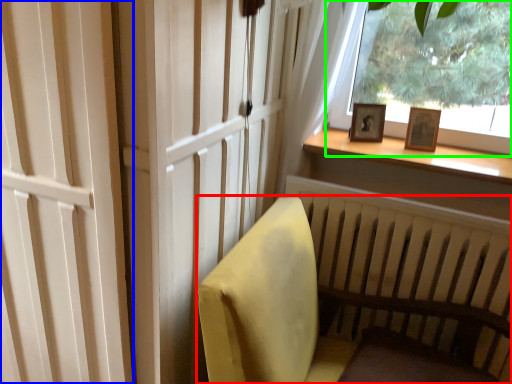
Question: Based on their relative distances, which object is farther from furniture (highlighted by a red box)? Choose from screen door (highlighted by a blue box) and window (highlighted by a green box).

Choices:
 (A) screen door
 (B) window

Answer: (B)